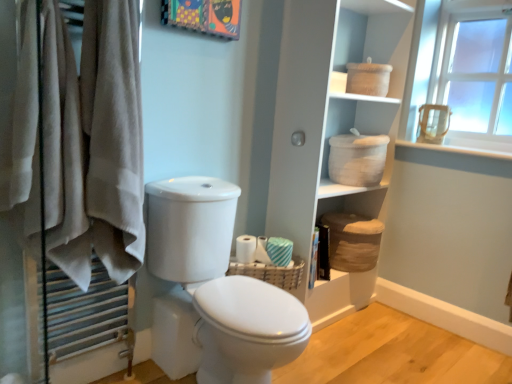
Describe the element at coordinates (270, 273) in the screenshot. I see `woven brown basket at center, marked as the second basket in a back-to-front arrangement` at that location.

Measure the distance between point [348,126] and camera.

The distance of point [348,126] from camera is 8.18 feet.

What is the approximate height of white fabric towels at left?

white fabric towels at left is 37.20 inches in height.

What do you see at coordinates (262, 251) in the screenshot? I see `white textured toilet paper at center, placed as the 2th toilet paper when sorted from right to left` at bounding box center [262, 251].

Describe the element at coordinates (330, 130) in the screenshot. The width and height of the screenshot is (512, 384). I see `white woven baskets at upper center` at that location.

At what (x,y) coordinates should I click in order to perform the action: click on white glossy toilet at center. Please return your answer as a coordinate pair (x, y). The height and width of the screenshot is (384, 512). Looking at the image, I should click on (190, 229).

The height and width of the screenshot is (384, 512). I want to click on closet below the beige cotton towel at left (from the image's perspective), so click(x=93, y=142).

Considering the sizes of objects beige cotton towel at left and white fabric towels at left in the image provided, who is taller, beige cotton towel at left or white fabric towels at left?

beige cotton towel at left.

Can you confirm if beige cotton towel at left is thinner than white fabric towels at left?

Yes, beige cotton towel at left is thinner than white fabric towels at left.

Considering the positions of objects beige cotton towel at left and white fabric towels at left in the image provided, who is more to the right, beige cotton towel at left or white fabric towels at left?

From the viewer's perspective, beige cotton towel at left appears more on the right side.

Consider the image. From a real-world perspective, does white glossy toilet at center stand above woven brown basket at center, placed as the first basket when sorted from front to back?

No, from a real-world perspective, white glossy toilet at center is not on top of woven brown basket at center, placed as the first basket when sorted from front to back.

Does white glossy toilet at center turn towards woven brown basket at center, the first basket viewed from the left?

No, white glossy toilet at center does not turn towards woven brown basket at center, the first basket viewed from the left.

From the image's perspective, is white glossy toilet at center positioned above or below woven brown basket at center, arranged as the second basket when viewed from the right?

white glossy toilet at center is below woven brown basket at center, arranged as the second basket when viewed from the right.

Is white glossy toilet at center positioned far away from woven brown basket at center, the first basket viewed from the left?

They are positioned close to each other.

Can you confirm if white woven baskets at upper center is shorter than white fabric towels at left?

In fact, white woven baskets at upper center may be taller than white fabric towels at left.

Considering the points (289, 63) and (93, 34), which point is behind, point (289, 63) or point (93, 34)?

The point (289, 63) is behind.

Considering the sizes of objects white woven baskets at upper center and white fabric towels at left in the image provided, who is wider, white woven baskets at upper center or white fabric towels at left?

white fabric towels at left is wider.

Which is more to the right, white woven baskets at upper center or white fabric towels at left?

white woven baskets at upper center is more to the right.

Choose the correct answer: Is beige cotton towel at left inside white textured toilet paper at center, arranged as the first toilet paper when viewed from the left, or outside it?

beige cotton towel at left cannot be found inside white textured toilet paper at center, arranged as the first toilet paper when viewed from the left.

Which of these two, beige cotton towel at left or white textured toilet paper at center, arranged as the first toilet paper when viewed from the left, is thinner?

white textured toilet paper at center, arranged as the first toilet paper when viewed from the left.

From a real-world perspective, is beige cotton towel at left located higher than white textured toilet paper at center, arranged as the first toilet paper when viewed from the left?

Yes, from a real-world perspective, beige cotton towel at left is over white textured toilet paper at center, arranged as the first toilet paper when viewed from the left

Is beige cotton towel at left aimed at white textured toilet paper at center, arranged as the first toilet paper when viewed from the left?

No, beige cotton towel at left is not aimed at white textured toilet paper at center, arranged as the first toilet paper when viewed from the left.

From the image's perspective, does white woven basket at upper right appear lower than brown woven basket at lower center, which appears as the 1th basket when viewed from the back?

Actually, white woven basket at upper right appears above brown woven basket at lower center, which appears as the 1th basket when viewed from the back, in the image.

Between white woven basket at upper right and brown woven basket at lower center, the second basket in the front-to-back sequence, which one has larger width?

Wider between the two is brown woven basket at lower center, the second basket in the front-to-back sequence.

Considering the sizes of objects white woven basket at upper right and brown woven basket at lower center, acting as the 1th basket starting from the right, in the image provided, who is bigger, white woven basket at upper right or brown woven basket at lower center, acting as the 1th basket starting from the right,?

brown woven basket at lower center, acting as the 1th basket starting from the right, is bigger.

From a real-world perspective, is white woven basket at upper right beneath brown woven basket at lower center, acting as the 1th basket starting from the right?

No, from a real-world perspective, white woven basket at upper right is not under brown woven basket at lower center, acting as the 1th basket starting from the right.

Which is closer to the camera, (275,305) or (264,262)?

The point (275,305) is closer.

Does white glossy toilet at center have a greater height compared to white textured toilet paper at center, arranged as the first toilet paper when viewed from the left?

Yes, white glossy toilet at center is taller than white textured toilet paper at center, arranged as the first toilet paper when viewed from the left.

Is white glossy toilet at center not within white textured toilet paper at center, placed as the 2th toilet paper when sorted from right to left?

Yes.

Can you confirm if white glossy toilet at center is positioned to the right of white textured toilet paper at center, arranged as the first toilet paper when viewed from the left?

No.

Which of these two, white woven basket at upper right or white glossy toilet at center, stands shorter?

With less height is white woven basket at upper right.

Is white woven basket at upper right closer to camera compared to white glossy toilet at center?

No, it is behind white glossy toilet at center.

Is point (362, 98) positioned in front of point (247, 315)?

That is False.

From a real-world perspective, between white woven basket at upper right and white glossy toilet at center, who is vertically lower?

white glossy toilet at center is physically lower.

Where is `bath towel that appears above the white fabric towels at left (from a real-world perspective)`? This screenshot has width=512, height=384. bath towel that appears above the white fabric towels at left (from a real-world perspective) is located at coordinates (113, 133).

In order to click on bidet on the left of woven brown basket at center, arranged as the second basket when viewed from the right in this screenshot , I will do [247, 330].

When comparing their distances from white fabric towels at left, does white woven basket at upper right or white striped fabric at right, the 2th toilet paper positioned from the left, seem further?

white woven basket at upper right.

Estimate the real-world distances between objects in this image. Which object is further from brown woven basket at lower center, the second basket in the front-to-back sequence, white striped fabric at right, acting as the 1th toilet paper starting from the right, or white glossy toilet at center?

white glossy toilet at center.

Which object lies nearer to the anchor point white glossy toilet at center, white striped fabric at right, the 2th toilet paper positioned from the left, or white fabric towels at left?

Based on the image, white striped fabric at right, the 2th toilet paper positioned from the left, appears to be nearer to white glossy toilet at center.

From the image, which object appears to be nearer to white woven baskets at upper center, white striped fabric at right, acting as the 1th toilet paper starting from the right, or woven brown basket at center, arranged as the second basket when viewed from the right?

woven brown basket at center, arranged as the second basket when viewed from the right, is closer to white woven baskets at upper center.

Which object lies nearer to the anchor point beige cotton towel at left, white glossy toilet at center or white woven basket at upper right?

white glossy toilet at center.

Which object lies nearer to the anchor point woven brown basket at center, marked as the second basket in a back-to-front arrangement, white textured toilet paper at center, placed as the 2th toilet paper when sorted from right to left, or white woven basket at upper right?

Based on the image, white textured toilet paper at center, placed as the 2th toilet paper when sorted from right to left, appears to be nearer to woven brown basket at center, marked as the second basket in a back-to-front arrangement.

Considering their positions, is white glossy toilet at center positioned closer to white woven basket at upper right than beige cotton towel at left?

white glossy toilet at center is positioned closer to the anchor white woven basket at upper right.

Looking at the image, which one is located closer to brown woven basket at lower center, the second basket in the front-to-back sequence, white woven baskets at upper center or white glossy toilet at center?

white woven baskets at upper center.

Identify the location of toilet that lies between white woven baskets at upper center and white glossy toilet at center from top to bottom. The image size is (512, 384). (190, 229).

The width and height of the screenshot is (512, 384). Find the location of `toilet between white fabric towels at left and white glossy toilet at center from top to bottom`. toilet between white fabric towels at left and white glossy toilet at center from top to bottom is located at coordinates (190, 229).

Find the location of a particular element. The width and height of the screenshot is (512, 384). toilet paper between white glossy toilet at center and white textured toilet paper at center, arranged as the first toilet paper when viewed from the left, in the front-back direction is located at coordinates (264, 250).

Locate an element on the screen. This screenshot has height=384, width=512. bath towel between white fabric towels at left and white textured toilet paper at center, placed as the 2th toilet paper when sorted from right to left, along the z-axis is located at coordinates (113, 133).